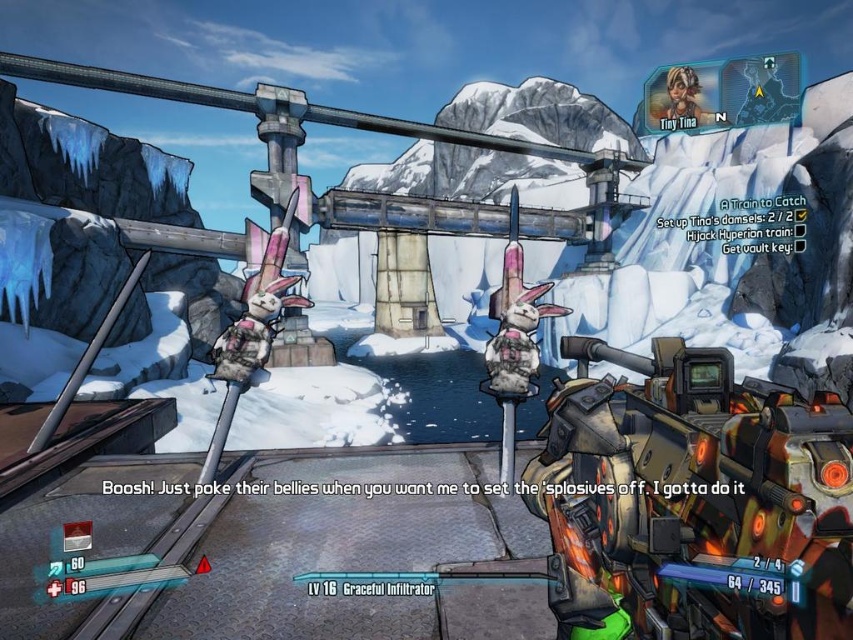
You are a player navigating through the icy environment in Borderlands. You need to move your character from the orange metallic robot at right to the metallic helmet at upper center. Considering their sizes, which object will you have to maneuver around more carefully?

The metallic helmet at upper center has a greater width than the orange metallic robot at right, so you will need to maneuver around it more carefully due to its larger size.

You are navigating a snowy level in a video game. You see an orange metallic robot at right and a metallic helmet at upper center. Which object is positioned lower in the scene?

The orange metallic robot at right is positioned lower than the metallic helmet at upper center.

You are a player navigating a snowy level in Borderlands. You see an orange metallic robot at right and a metallic helmet at upper center. How far apart are these two objects?

The orange metallic robot at right is 38.34 meters from the metallic helmet at upper center.